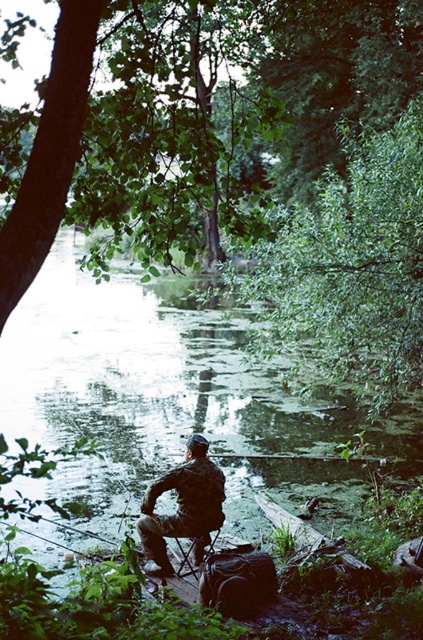
Does green leafy tree at upper left have a lesser height compared to camouflage fabric fisherman at center?

No, green leafy tree at upper left is not shorter than camouflage fabric fisherman at center.

Who is higher up, green leafy tree at upper left or camouflage fabric fisherman at center?

green leafy tree at upper left is higher up.

Identify the location of green leafy tree at upper left. (195, 120).

You are a GUI agent. You are given a task and a screenshot of the screen. Output one action in this format:
    pyautogui.click(x=<x>, y=<y>)
    Task: Click on the green leafy tree at upper left
    
    Given the screenshot: What is the action you would take?
    pyautogui.click(x=195, y=120)

This screenshot has width=423, height=640. What do you see at coordinates (183, 508) in the screenshot?
I see `camouflage fabric fisherman at center` at bounding box center [183, 508].

Which is above, camouflage fabric fisherman at center or metallic folding chair at center?

camouflage fabric fisherman at center

Locate an element on the screen. The width and height of the screenshot is (423, 640). camouflage fabric fisherman at center is located at coordinates (183, 508).

Where is `green leafy tree at upper center`? green leafy tree at upper center is located at coordinates (348, 269).

Who is taller, green leafy tree at upper center or camouflage fabric fisherman at center?

With more height is green leafy tree at upper center.

Is point (403, 381) positioned behind point (162, 516)?

Yes, point (403, 381) is behind point (162, 516).

Where is `green leafy tree at upper center`? green leafy tree at upper center is located at coordinates (348, 269).